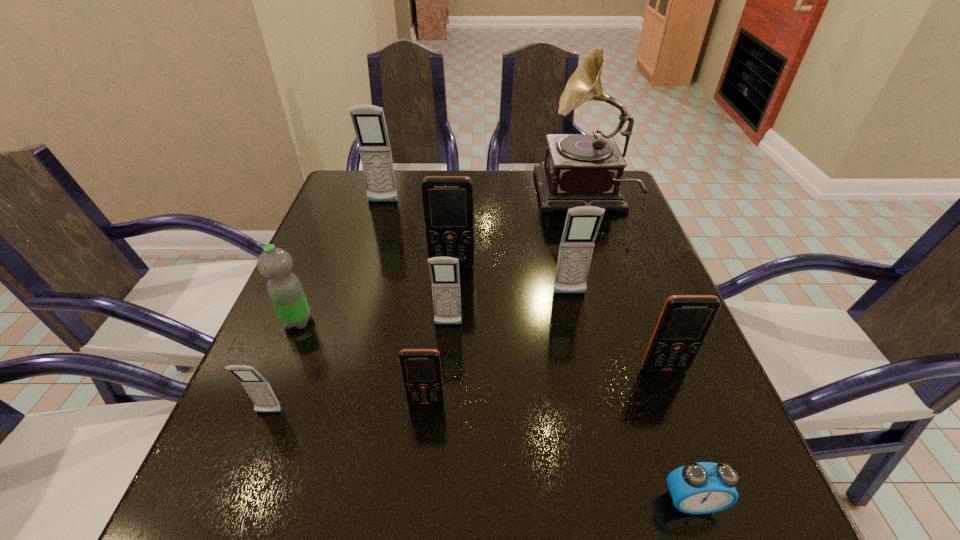
At what (x,y) coordinates should I click in order to perform the action: click on the tallest object. Please return your answer as a coordinate pair (x, y). Looking at the image, I should click on (579, 170).

I want to click on golden record player, so click(579, 170).

I want to click on the eighth object from right to left, so click(x=369, y=123).

You are a GUI agent. You are given a task and a screenshot of the screen. Output one action in this format:
    pyautogui.click(x=<x>, y=<y>)
    Task: Click on the farthest gray cellular telephone
    The height and width of the screenshot is (540, 960).
    Given the screenshot: What is the action you would take?
    pyautogui.click(x=369, y=123)

Identify the location of the sixth cellular telephone from left to right. (582, 223).

Where is `the fourth farthest object`? Image resolution: width=960 pixels, height=540 pixels. the fourth farthest object is located at coordinates (582, 223).

The width and height of the screenshot is (960, 540). Find the location of `the farthest orange cellular telephone`. the farthest orange cellular telephone is located at coordinates (447, 200).

Image resolution: width=960 pixels, height=540 pixels. I want to click on the biggest orange cellular telephone, so click(447, 200).

This screenshot has height=540, width=960. In order to click on water bottle in this screenshot , I will do `click(285, 290)`.

The width and height of the screenshot is (960, 540). Identify the location of the second smallest gray cellular telephone. (444, 271).